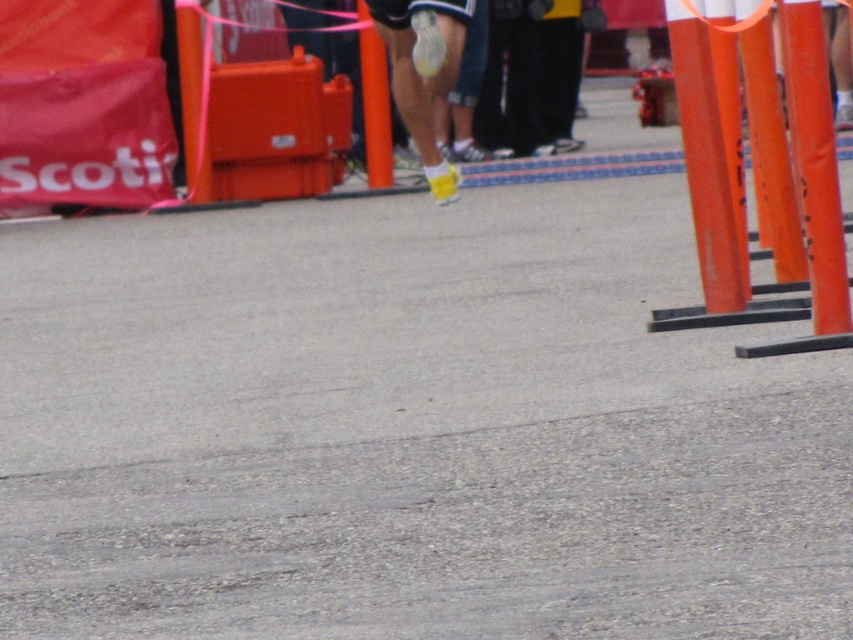
Question: Which point is closer to the camera taking this photo?

Choices:
 (A) (682, 49)
 (B) (364, 113)

Answer: (A)

Question: Which point is closer to the camera taking this photo?

Choices:
 (A) (387, 131)
 (B) (734, 307)

Answer: (B)

Question: Which of the following is the closest to the observer?

Choices:
 (A) orange plastic pole at right
 (B) orange matte pole at center-right

Answer: (B)

Question: Does orange matte pole at center-right have a larger size compared to yellow matte socks at center?

Choices:
 (A) no
 (B) yes

Answer: (A)

Question: Observing the image, what is the correct spatial positioning of orange matte pole at center-right in reference to orange plastic pole at right?

Choices:
 (A) left
 (B) right

Answer: (B)

Question: Can you confirm if orange plastic pole at right is wider than orange plastic pole at center?

Choices:
 (A) yes
 (B) no

Answer: (A)